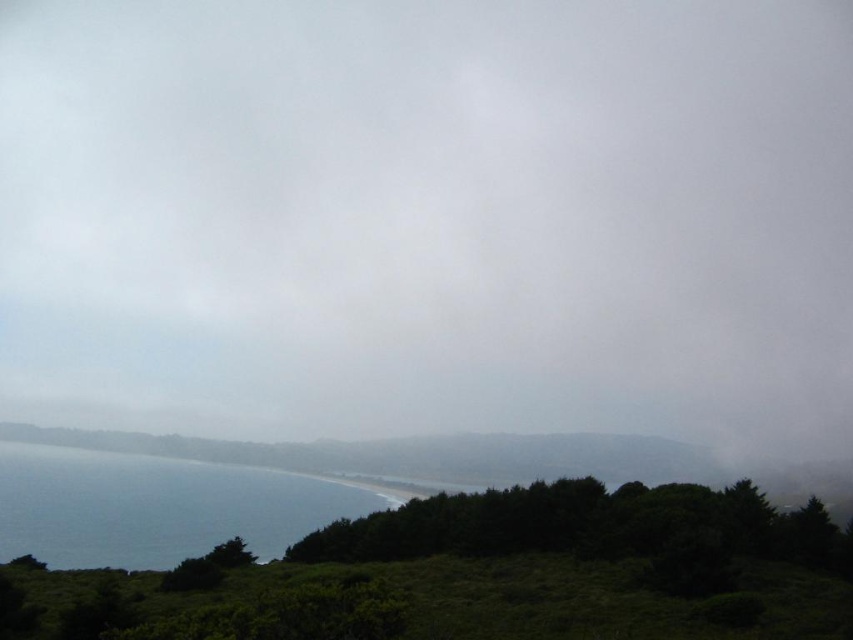
Is point (213, 45) closer to viewer compared to point (61, 493)?

No, it is not.

Which is above, white fluffy cloud at upper center or blue water at lower left?

white fluffy cloud at upper center

Between point (583, 1) and point (96, 467), which one is positioned in front?

Positioned in front is point (96, 467).

The height and width of the screenshot is (640, 853). Find the location of `white fluffy cloud at upper center`. white fluffy cloud at upper center is located at coordinates point(430,218).